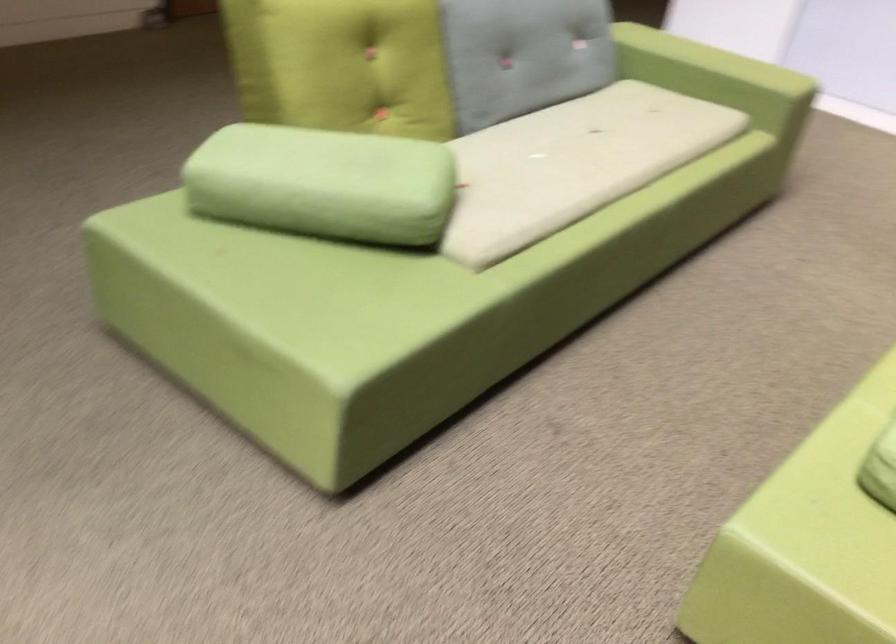
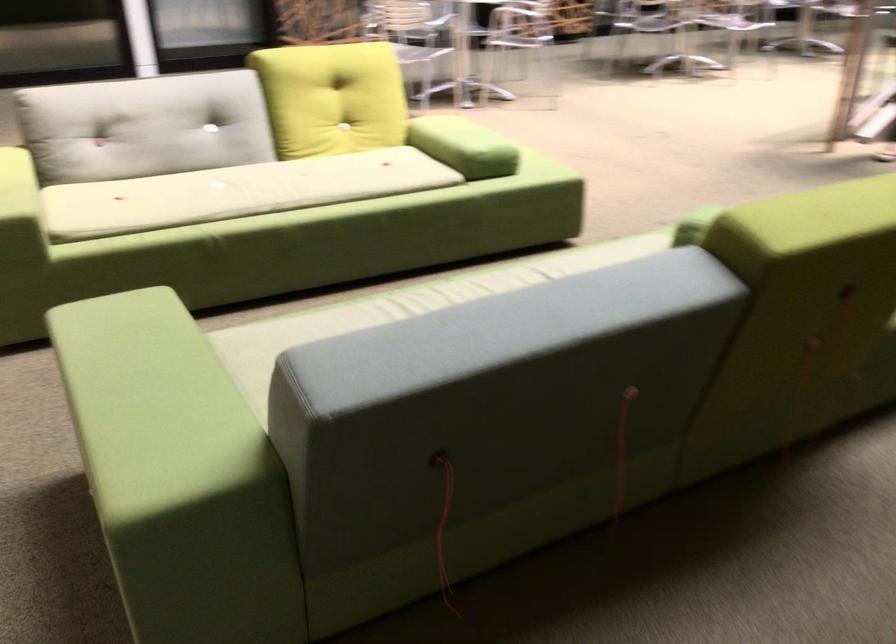
Find the pixel in the second image that matches point (427, 160) in the first image.

(694, 225)